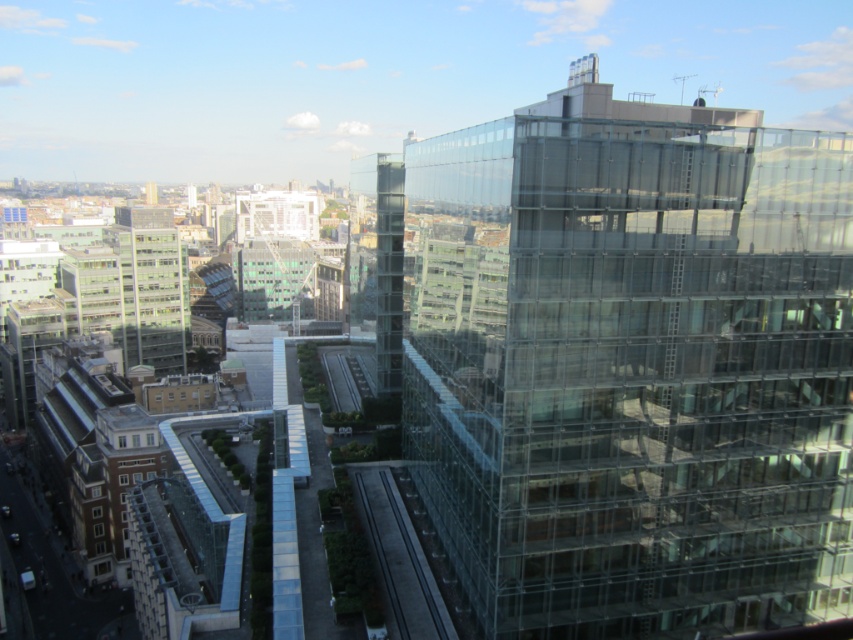
Can you confirm if transparent glass building at right is positioned below transparent glass elevator at center?

Yes.

Who is positioned more to the right, transparent glass building at right or transparent glass elevator at center?

From the viewer's perspective, transparent glass building at right appears more on the right side.

Which is behind, point (521, 108) or point (396, 259)?

Positioned behind is point (521, 108).

You are a GUI agent. You are given a task and a screenshot of the screen. Output one action in this format:
    pyautogui.click(x=<x>, y=<y>)
    Task: Click on the transparent glass building at right
    
    Given the screenshot: What is the action you would take?
    pyautogui.click(x=631, y=365)